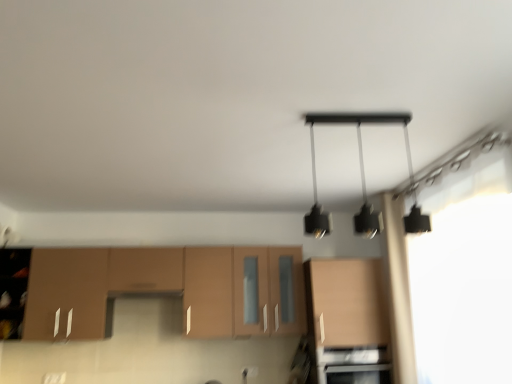
Question: Considering the relative positions of black stainless steel oven at lower center and matte wood cabinetry at lower left, the 1th cabinetry when ordered from left to right, in the image provided, is black stainless steel oven at lower center to the right of matte wood cabinetry at lower left, the 1th cabinetry when ordered from left to right, from the viewer's perspective?

Choices:
 (A) yes
 (B) no

Answer: (A)

Question: Considering the relative sizes of black stainless steel oven at lower center and matte wood cabinetry at lower left, the 1th cabinetry when ordered from left to right, in the image provided, is black stainless steel oven at lower center bigger than matte wood cabinetry at lower left, the 1th cabinetry when ordered from left to right,?

Choices:
 (A) no
 (B) yes

Answer: (A)

Question: Is there a large distance between black stainless steel oven at lower center and matte wood cabinetry at lower left, arranged as the 2th cabinetry when viewed from the right?

Choices:
 (A) no
 (B) yes

Answer: (A)

Question: Could you tell me if black stainless steel oven at lower center is facing matte wood cabinetry at lower left, the 1th cabinetry when ordered from left to right?

Choices:
 (A) no
 (B) yes

Answer: (A)

Question: Does black stainless steel oven at lower center touch matte wood cabinetry at lower left, the 1th cabinetry when ordered from left to right?

Choices:
 (A) no
 (B) yes

Answer: (A)

Question: Does point (69, 276) appear closer or farther from the camera than point (358, 365)?

Choices:
 (A) farther
 (B) closer

Answer: (A)

Question: Considering the relative positions of matte wood cabinetry at lower left, arranged as the 2th cabinetry when viewed from the right, and black stainless steel oven at lower center in the image provided, is matte wood cabinetry at lower left, arranged as the 2th cabinetry when viewed from the right, to the left or to the right of black stainless steel oven at lower center?

Choices:
 (A) left
 (B) right

Answer: (A)

Question: Looking at their shapes, would you say matte wood cabinetry at lower left, arranged as the 2th cabinetry when viewed from the right, is wider or thinner than black stainless steel oven at lower center?

Choices:
 (A) thin
 (B) wide

Answer: (A)

Question: Is matte wood cabinetry at lower left, the 1th cabinetry when ordered from left to right, spatially inside black stainless steel oven at lower center, or outside of it?

Choices:
 (A) inside
 (B) outside

Answer: (B)

Question: Does point (355, 374) appear closer or farther from the camera than point (308, 226)?

Choices:
 (A) farther
 (B) closer

Answer: (A)

Question: Is black stainless steel oven at lower center wider or thinner than black matte pendant light at upper center?

Choices:
 (A) wide
 (B) thin

Answer: (A)

Question: Considering the positions of black stainless steel oven at lower center and black matte pendant light at upper center in the image, is black stainless steel oven at lower center taller or shorter than black matte pendant light at upper center?

Choices:
 (A) tall
 (B) short

Answer: (B)

Question: In the image, is black stainless steel oven at lower center on the left side or the right side of black matte pendant light at upper center?

Choices:
 (A) right
 (B) left

Answer: (A)

Question: From the image's perspective, relative to transparent fabric at upper right, is black stainless steel oven at lower center above or below?

Choices:
 (A) above
 (B) below

Answer: (B)

Question: Is black stainless steel oven at lower center wider or thinner than transparent fabric at upper right?

Choices:
 (A) thin
 (B) wide

Answer: (B)